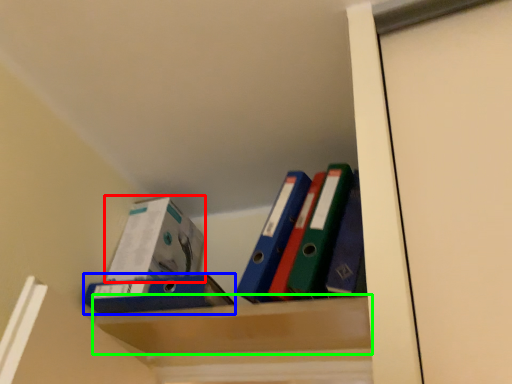
Question: Based on their relative distances, which object is nearer to box (highlighted by a red box)? Choose from paperback book (highlighted by a blue box) and cabinet (highlighted by a green box).

Choices:
 (A) paperback book
 (B) cabinet

Answer: (A)